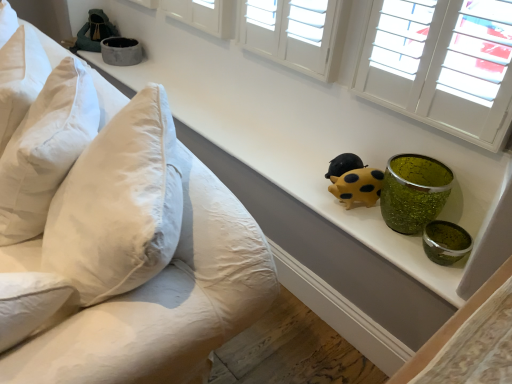
I want to click on white cotton pillows at left, so click(121, 244).

Describe the element at coordinates (354, 181) in the screenshot. I see `yellow matte pig at center, positioned as the first toy in right-to-left order` at that location.

What are the coordinates of `yellow matte pig at center, which is counted as the 2th toy, starting from the left` in the screenshot? It's located at (354, 181).

What do you see at coordinates (121, 51) in the screenshot? The height and width of the screenshot is (384, 512). I see `matte gray bowl at upper left` at bounding box center [121, 51].

Identify the location of velvet green bag at upper left, placed as the 2th toy when sorted from front to back. This screenshot has height=384, width=512. (92, 33).

Find the location of a particular element. The image size is (512, 384). white cotton pillow at left, positioned as the 2th pillow in top-to-bottom order is located at coordinates (45, 149).

In terms of height, does matte gray bowl at upper left look taller or shorter compared to white cotton pillow at left, marked as the first pillow in a bottom-to-top arrangement?

Considering their sizes, matte gray bowl at upper left has less height than white cotton pillow at left, marked as the first pillow in a bottom-to-top arrangement.

From the image's perspective, is matte gray bowl at upper left above white cotton pillow at left, positioned as the 2th pillow in top-to-bottom order?

Yes.

Is matte gray bowl at upper left looking in the opposite direction of white cotton pillow at left, positioned as the 2th pillow in top-to-bottom order?

That's not correct — matte gray bowl at upper left is not looking away from white cotton pillow at left, positioned as the 2th pillow in top-to-bottom order.

Could white cotton pillow at left, marked as the first pillow in a bottom-to-top arrangement, be considered to be inside matte gray bowl at upper left?

No, white cotton pillow at left, marked as the first pillow in a bottom-to-top arrangement, is not inside matte gray bowl at upper left.

Considering the relative positions of yellow matte pig at center, which ranks as the 2th toy in top-to-bottom order, and white cotton pillows at left in the image provided, is yellow matte pig at center, which ranks as the 2th toy in top-to-bottom order, to the left or to the right of white cotton pillows at left?

Based on their positions, yellow matte pig at center, which ranks as the 2th toy in top-to-bottom order, is located to the right of white cotton pillows at left.

This screenshot has width=512, height=384. I want to click on furniture on the left of yellow matte pig at center, which is the second toy from back to front, so click(121, 244).

Consider the image. Is yellow matte pig at center, positioned as the first toy in right-to-left order, wider than white cotton pillows at left?

Incorrect, the width of yellow matte pig at center, positioned as the first toy in right-to-left order, does not surpass that of white cotton pillows at left.

From the image's perspective, is velvet green bag at upper left, acting as the 2th toy starting from the right, on top of matte gray bowl at upper left?

Indeed, from the image's perspective, velvet green bag at upper left, acting as the 2th toy starting from the right, is shown above matte gray bowl at upper left.

Based on their positions, is velvet green bag at upper left, placed as the 2th toy when sorted from front to back, located to the left or right of matte gray bowl at upper left?

In the image, velvet green bag at upper left, placed as the 2th toy when sorted from front to back, appears on the left side of matte gray bowl at upper left.

Is velvet green bag at upper left, acting as the 2th toy starting from the right, facing away from matte gray bowl at upper left?

No, matte gray bowl at upper left is not at the back of velvet green bag at upper left, acting as the 2th toy starting from the right.

Measure the distance from velvet green bag at upper left, positioned as the 2th toy in bottom-to-top order, to matte gray bowl at upper left.

velvet green bag at upper left, positioned as the 2th toy in bottom-to-top order, is 7.81 inches from matte gray bowl at upper left.

Where is `pillow lying on the right of white soft pillow at upper left, positioned as the 1th pillow in top-to-bottom order`? The height and width of the screenshot is (384, 512). pillow lying on the right of white soft pillow at upper left, positioned as the 1th pillow in top-to-bottom order is located at coordinates (45, 149).

Considering the positions of point (60, 98) and point (11, 121), is point (60, 98) closer or farther from the camera than point (11, 121)?

Point (60, 98) is positioned closer to the camera compared to point (11, 121).

In the image, is white cotton pillow at left, marked as the first pillow in a bottom-to-top arrangement, positioned in front of or behind white soft pillow at upper left, which is the 2th pillow from bottom to top?

white cotton pillow at left, marked as the first pillow in a bottom-to-top arrangement, is positioned closer to the viewer than white soft pillow at upper left, which is the 2th pillow from bottom to top.

Which object is wider, white cotton pillow at left, positioned as the 2th pillow in top-to-bottom order, or white soft pillow at upper left, positioned as the 1th pillow in top-to-bottom order?

white cotton pillow at left, positioned as the 2th pillow in top-to-bottom order, is wider.

From the image's perspective, which is below, white cotton pillow at left, positioned as the 2th pillow in top-to-bottom order, or white cotton pillows at left?

From the image's view, white cotton pillows at left is below.

Is white cotton pillows at left surrounded by white cotton pillow at left, marked as the first pillow in a bottom-to-top arrangement?

That's incorrect, white cotton pillows at left is not inside white cotton pillow at left, marked as the first pillow in a bottom-to-top arrangement.

Which is more to the left, white cotton pillow at left, marked as the first pillow in a bottom-to-top arrangement, or white cotton pillows at left?

white cotton pillows at left.

Locate an element on the screen. The image size is (512, 384). furniture below the white cotton pillow at left, marked as the first pillow in a bottom-to-top arrangement (from the image's perspective) is located at coordinates (121, 244).

From a real-world perspective, is matte gray bowl at upper left positioned above or below velvet green bag at upper left, positioned as the 2th toy in bottom-to-top order?

matte gray bowl at upper left is situated lower than velvet green bag at upper left, positioned as the 2th toy in bottom-to-top order, in the real world.

You are a GUI agent. You are given a task and a screenshot of the screen. Output one action in this format:
    pyautogui.click(x=<x>, y=<y>)
    Task: Click on the toy on the left of matte gray bowl at upper left
    The width and height of the screenshot is (512, 384).
    Given the screenshot: What is the action you would take?
    pyautogui.click(x=92, y=33)

Visually, is matte gray bowl at upper left positioned to the left or to the right of velvet green bag at upper left, which is the 1th toy in back-to-front order?

matte gray bowl at upper left is to the right of velvet green bag at upper left, which is the 1th toy in back-to-front order.

How much distance is there between matte gray bowl at upper left and velvet green bag at upper left, the first toy when ordered from left to right?

A distance of 19.83 centimeters exists between matte gray bowl at upper left and velvet green bag at upper left, the first toy when ordered from left to right.

Is white cotton pillow at left, marked as the first pillow in a bottom-to-top arrangement, positioned with its back to yellow matte pig at center, which ranks as the 2th toy in top-to-bottom order?

No, yellow matte pig at center, which ranks as the 2th toy in top-to-bottom order, is not at the back of white cotton pillow at left, marked as the first pillow in a bottom-to-top arrangement.

Would you say white cotton pillow at left, marked as the first pillow in a bottom-to-top arrangement, is inside or outside yellow matte pig at center, positioned as the first toy in right-to-left order?

white cotton pillow at left, marked as the first pillow in a bottom-to-top arrangement, exists outside the volume of yellow matte pig at center, positioned as the first toy in right-to-left order.

From the image's perspective, is white cotton pillow at left, positioned as the 2th pillow in top-to-bottom order, below yellow matte pig at center, which ranks as the 2th toy in top-to-bottom order?

Incorrect, from the image's perspective, white cotton pillow at left, positioned as the 2th pillow in top-to-bottom order, is higher than yellow matte pig at center, which ranks as the 2th toy in top-to-bottom order.

Where is `the 2nd pillow below the matte gray bowl at upper left (from the image's perspective)`? The height and width of the screenshot is (384, 512). the 2nd pillow below the matte gray bowl at upper left (from the image's perspective) is located at coordinates (45, 149).

What are the coordinates of `the 1st toy behind the white cotton pillows at left` in the screenshot? It's located at (354, 181).

Which object lies nearer to the anchor point matte gray bowl at upper left, velvet green bag at upper left, positioned as the 2th toy in bottom-to-top order, or white cotton pillow at left, marked as the first pillow in a bottom-to-top arrangement?

velvet green bag at upper left, positioned as the 2th toy in bottom-to-top order, lies closer to matte gray bowl at upper left than the other object.

Estimate the real-world distances between objects in this image. Which object is further from yellow matte pig at center, the first toy when ordered from front to back, white cotton pillow at left, marked as the first pillow in a bottom-to-top arrangement, or matte gray bowl at upper left?

matte gray bowl at upper left is further to yellow matte pig at center, the first toy when ordered from front to back.

Looking at the image, which one is located closer to white cotton pillow at left, positioned as the 2th pillow in top-to-bottom order, matte gray bowl at upper left or yellow matte pig at center, acting as the 1th toy starting from the bottom?

Based on the image, yellow matte pig at center, acting as the 1th toy starting from the bottom, appears to be nearer to white cotton pillow at left, positioned as the 2th pillow in top-to-bottom order.

Looking at the image, which one is located further to white cotton pillows at left, white soft pillow at upper left, positioned as the 1th pillow in top-to-bottom order, or velvet green bag at upper left, which is the 1th toy in back-to-front order?

Among the two, velvet green bag at upper left, which is the 1th toy in back-to-front order, is located further to white cotton pillows at left.

From the image, which object appears to be nearer to white cotton pillows at left, white cotton pillow at left, positioned as the 2th pillow in top-to-bottom order, or white soft pillow at upper left, positioned as the 1th pillow in top-to-bottom order?

white cotton pillow at left, positioned as the 2th pillow in top-to-bottom order.

Based on their spatial positions, is white soft pillow at upper left, which is the 2th pillow from bottom to top, or white cotton pillows at left further from white cotton pillow at left, marked as the first pillow in a bottom-to-top arrangement?

Based on the image, white soft pillow at upper left, which is the 2th pillow from bottom to top, appears to be further to white cotton pillow at left, marked as the first pillow in a bottom-to-top arrangement.

Considering their positions, is white soft pillow at upper left, which is the 2th pillow from bottom to top, positioned closer to matte gray bowl at upper left than white cotton pillow at left, positioned as the 2th pillow in top-to-bottom order?

white soft pillow at upper left, which is the 2th pillow from bottom to top, lies closer to matte gray bowl at upper left than the other object.

Estimate the real-world distances between objects in this image. Which object is further from velvet green bag at upper left, the first toy when ordered from left to right, matte gray bowl at upper left or white cotton pillows at left?

Among the two, white cotton pillows at left is located further to velvet green bag at upper left, the first toy when ordered from left to right.

Where is `pillow positioned between white cotton pillows at left and white soft pillow at upper left, positioned as the 1th pillow in top-to-bottom order, from near to far`? pillow positioned between white cotton pillows at left and white soft pillow at upper left, positioned as the 1th pillow in top-to-bottom order, from near to far is located at coordinates (45, 149).

This screenshot has width=512, height=384. I want to click on furniture between white soft pillow at upper left, which is the 2th pillow from bottom to top, and yellow matte pig at center, the first toy when ordered from front to back, in the horizontal direction, so click(121, 244).

At what (x,y) coordinates should I click in order to perform the action: click on toy positioned between white cotton pillows at left and velvet green bag at upper left, the first toy when ordered from left to right, from near to far. Please return your answer as a coordinate pair (x, y). Looking at the image, I should click on (354, 181).

You are a GUI agent. You are given a task and a screenshot of the screen. Output one action in this format:
    pyautogui.click(x=<x>, y=<y>)
    Task: Click on the glass bowl between white soft pillow at upper left, which is the 2th pillow from bottom to top, and yellow matte pig at center, positioned as the first toy in right-to-left order, in the horizontal direction
    
    Given the screenshot: What is the action you would take?
    pyautogui.click(x=121, y=51)